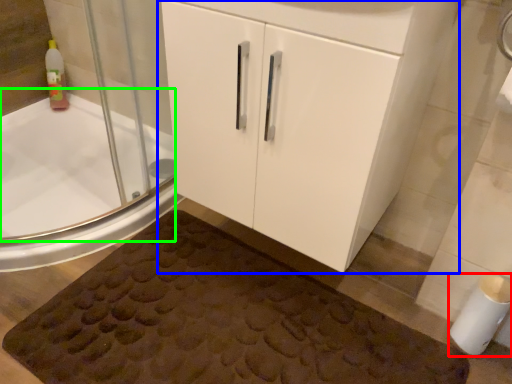
Question: Which object is the farthest from toilet paper (highlighted by a red box)? Choose among these: bathroom cabinet (highlighted by a blue box) or bath (highlighted by a green box).

Choices:
 (A) bathroom cabinet
 (B) bath

Answer: (B)